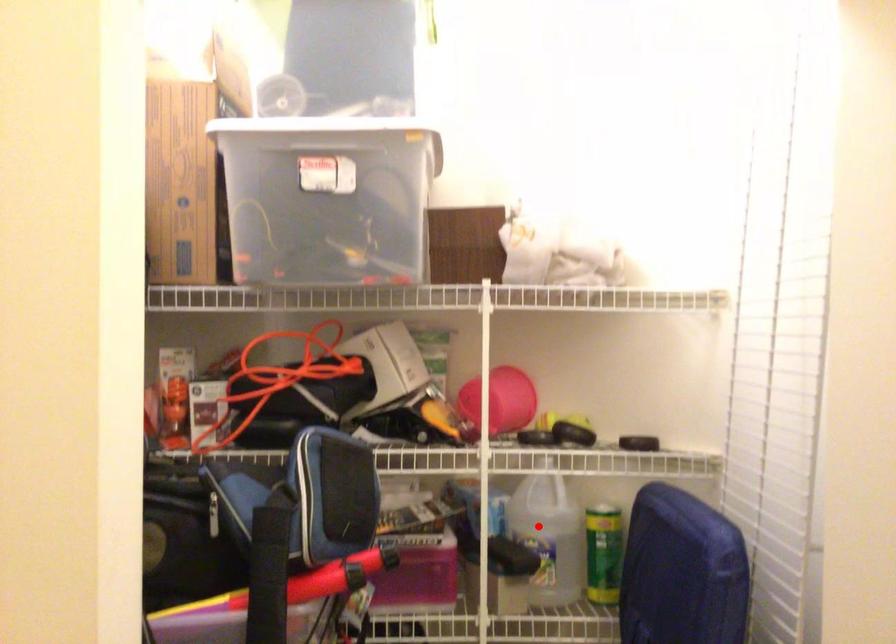
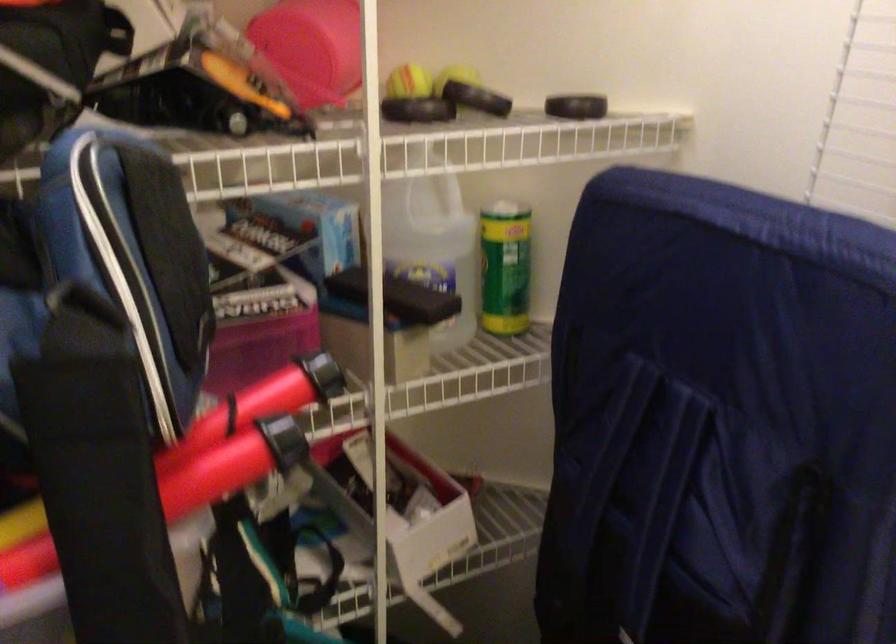
Question: I am providing you with two images of the same scene from different viewpoints. In image1, a red point is highlighted. Considering the same 3D point in image2, which of the following is correct?

Choices:
 (A) It is closer
 (B) It is farther

Answer: (A)